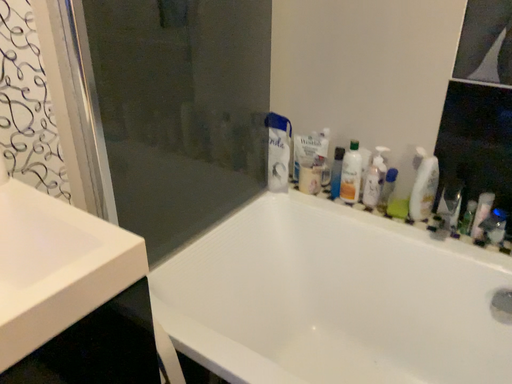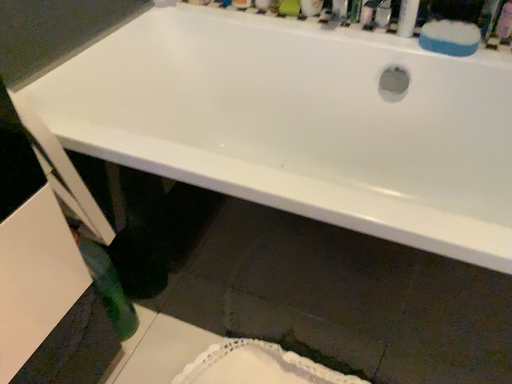
Question: Which way did the camera rotate in the video?

Choices:
 (A) rotated right
 (B) rotated left

Answer: (A)